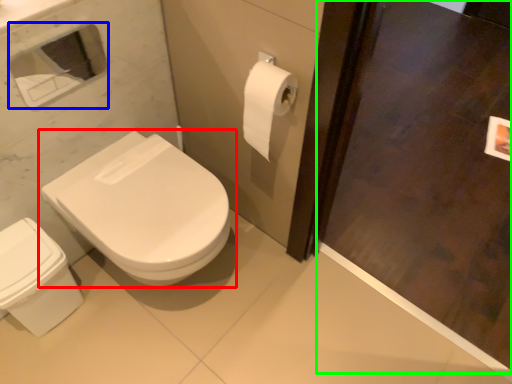
Question: Which object is positioned farthest from toilet (highlighted by a red box)? Select from medicine cabinet (highlighted by a blue box) and screen door (highlighted by a green box).

Choices:
 (A) medicine cabinet
 (B) screen door

Answer: (A)